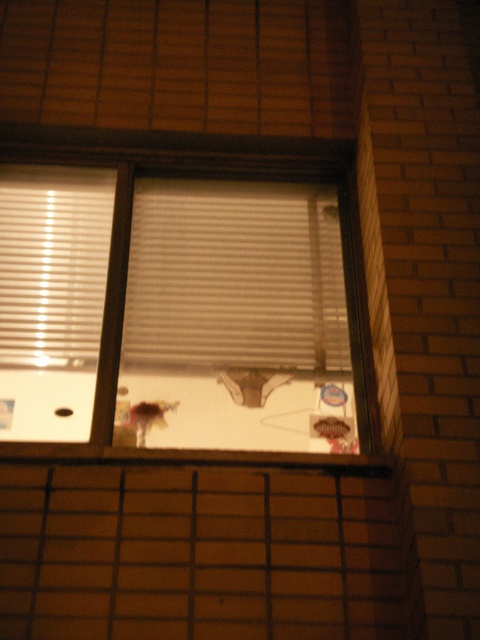
Question: Is white matte window at center closer to the viewer compared to white matte blinds at center?

Choices:
 (A) yes
 (B) no

Answer: (A)

Question: Based on their relative distances, which object is nearer to the smooth wood window sill at center?

Choices:
 (A) white matte window at center
 (B) white matte blinds at center
 (C) white matte blinds at left

Answer: (A)

Question: Which object is positioned closest to the white matte window at center?

Choices:
 (A) white matte blinds at center
 (B) white matte blinds at left

Answer: (A)

Question: In this image, where is white matte window at center located relative to white matte blinds at center?

Choices:
 (A) above
 (B) below

Answer: (B)

Question: Is white matte window at center below white matte blinds at center?

Choices:
 (A) no
 (B) yes

Answer: (B)

Question: Which point is farther to the camera?

Choices:
 (A) (336, 333)
 (B) (90, 364)

Answer: (A)